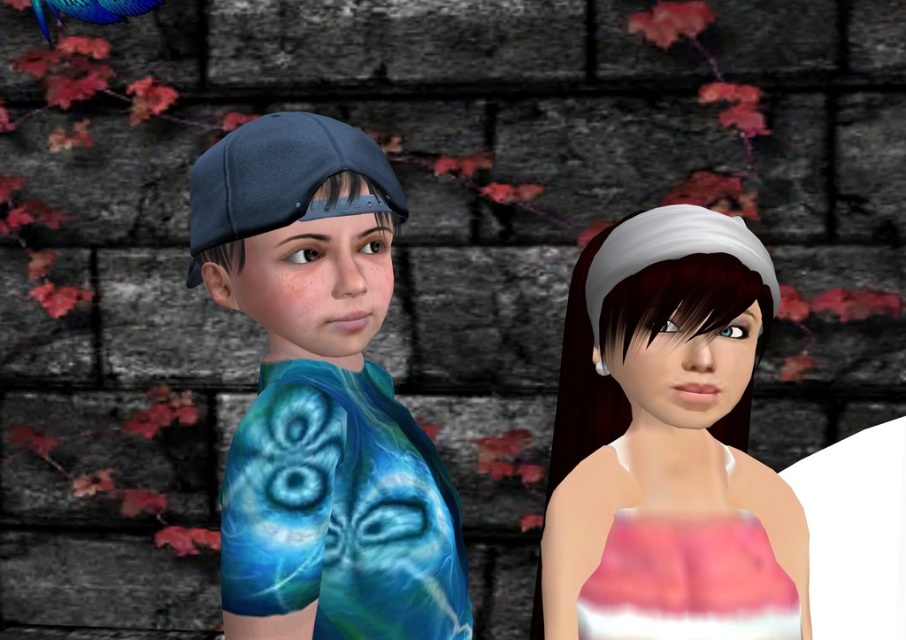
You are an artist sketching the two characters in the image. You need to draw the white matte hairband at upper right and the matte blue baseball cap at left. Which object should you draw first to maintain proper perspective?

You should draw the white matte hairband at upper right first because it is below the matte blue baseball cap at left, so it will be covered if drawn afterward.